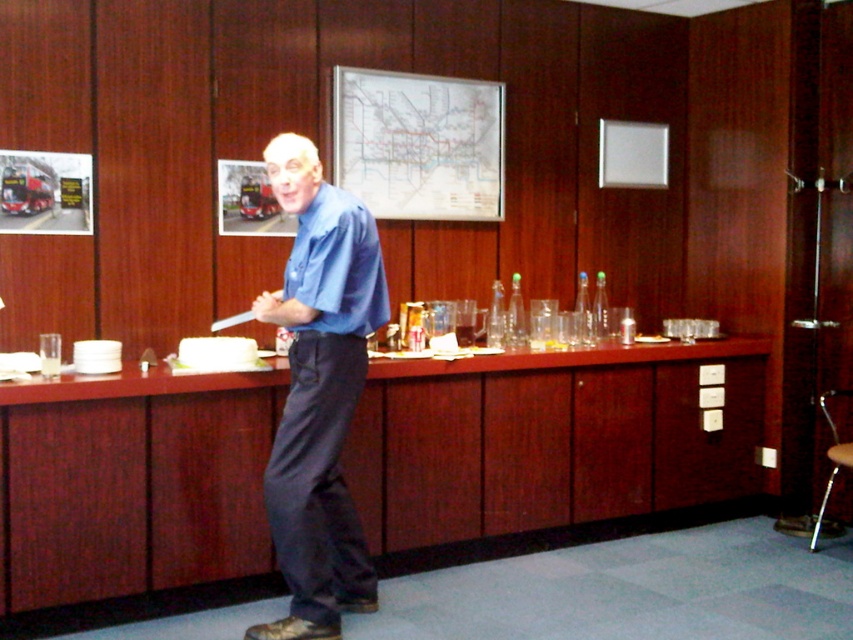
Between point (381, 289) and point (834, 477), which one is positioned behind?

Point (834, 477)

Between blue smooth shirt at center and metallic silver stool at lower right, which one is positioned lower?

metallic silver stool at lower right is lower down.

What do you see at coordinates (318, 394) in the screenshot? I see `blue smooth shirt at center` at bounding box center [318, 394].

This screenshot has height=640, width=853. I want to click on blue smooth shirt at center, so [x=318, y=394].